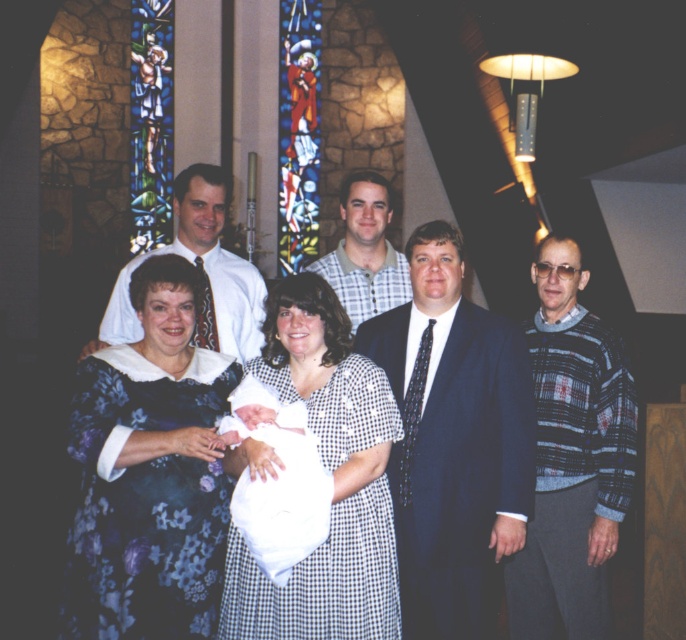
Which is behind, point (134, 445) or point (508, 344)?

Point (508, 344)

Is point (198, 589) less distant than point (418, 401)?

Yes, it is.

You are a GUI agent. You are given a task and a screenshot of the screen. Output one action in this format:
    pyautogui.click(x=<x>, y=<y>)
    Task: Click on the floral-patterned dress at center
    The width and height of the screenshot is (686, 640).
    Given the screenshot: What is the action you would take?
    pyautogui.click(x=150, y=472)

Can you confirm if floral dress at center is smaller than white cloth at center?

Actually, floral dress at center might be larger than white cloth at center.

Can you confirm if floral dress at center is positioned above white cloth at center?

Indeed, floral dress at center is positioned over white cloth at center.

At what (x,y) coordinates should I click in order to perform the action: click on floral dress at center. Please return your answer as a coordinate pair (x, y). The height and width of the screenshot is (640, 686). Looking at the image, I should click on (571, 461).

Between dark blue suit at center and checkered fabric shirt at center, which one is positioned higher?

checkered fabric shirt at center is higher up.

Consider the image. Which is below, dark blue suit at center or checkered fabric shirt at center?

dark blue suit at center is below.

Between point (493, 480) and point (357, 323), which one is positioned behind?

The point (357, 323) is more distant.

This screenshot has width=686, height=640. I want to click on dark blue suit at center, so click(x=453, y=440).